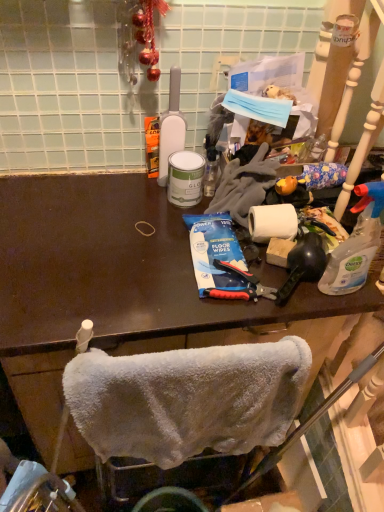
Question: Is clear plastic spray bottle at right, acting as the 2th bottle starting from the left, outside white fluffy towel at lower center?

Choices:
 (A) no
 (B) yes

Answer: (B)

Question: Considering the relative sizes of clear plastic spray bottle at right, which appears as the 2th bottle when viewed from the top, and white fluffy towel at lower center in the image provided, is clear plastic spray bottle at right, which appears as the 2th bottle when viewed from the top, shorter than white fluffy towel at lower center?

Choices:
 (A) yes
 (B) no

Answer: (A)

Question: Is white fluffy towel at lower center at the back of clear plastic spray bottle at right, acting as the 2th bottle starting from the left?

Choices:
 (A) yes
 (B) no

Answer: (B)

Question: Considering the relative positions of clear plastic spray bottle at right, arranged as the 1th bottle when ordered from the bottom, and white fluffy towel at lower center in the image provided, is clear plastic spray bottle at right, arranged as the 1th bottle when ordered from the bottom, behind white fluffy towel at lower center?

Choices:
 (A) yes
 (B) no

Answer: (A)

Question: Is clear plastic spray bottle at right, which is the 1th bottle from right to left, positioned in front of white fluffy towel at lower center?

Choices:
 (A) no
 (B) yes

Answer: (A)

Question: Can you confirm if clear plastic spray bottle at right, which is the second bottle in back-to-front order, is taller than white fluffy towel at lower center?

Choices:
 (A) no
 (B) yes

Answer: (A)

Question: Is clear plastic spray bottle at right, arranged as the 1th bottle when ordered from the bottom, thinner than blue plastic toothpaste at center?

Choices:
 (A) yes
 (B) no

Answer: (A)

Question: Is clear plastic spray bottle at right, which appears as the 2th bottle when viewed from the top, oriented towards blue plastic toothpaste at center?

Choices:
 (A) no
 (B) yes

Answer: (A)

Question: Can you confirm if clear plastic spray bottle at right, which is the second bottle in back-to-front order, is taller than blue plastic toothpaste at center?

Choices:
 (A) yes
 (B) no

Answer: (A)

Question: Can you confirm if clear plastic spray bottle at right, arranged as the 1th bottle when ordered from the bottom, is wider than blue plastic toothpaste at center?

Choices:
 (A) yes
 (B) no

Answer: (B)

Question: Is clear plastic spray bottle at right, which appears as the 2th bottle when viewed from the top, positioned beyond the bounds of blue plastic toothpaste at center?

Choices:
 (A) yes
 (B) no

Answer: (A)

Question: Considering the relative positions of clear plastic spray bottle at right, acting as the 2th bottle starting from the left, and blue plastic toothpaste at center in the image provided, is clear plastic spray bottle at right, acting as the 2th bottle starting from the left, to the left of blue plastic toothpaste at center from the viewer's perspective?

Choices:
 (A) no
 (B) yes

Answer: (A)

Question: Does white matte bottle at upper center, arranged as the 1th bottle when viewed from the top, contain blue plastic toothpaste at center?

Choices:
 (A) yes
 (B) no

Answer: (B)